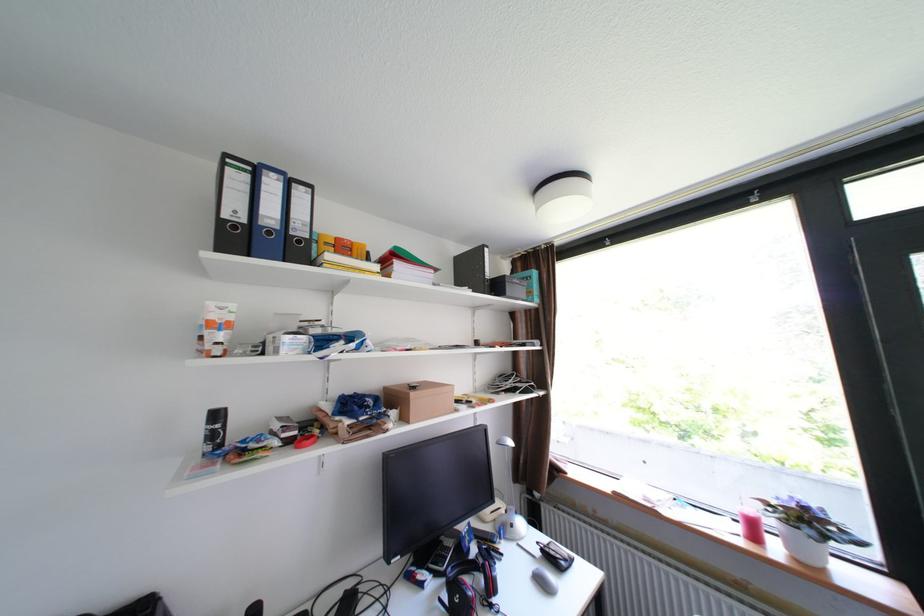
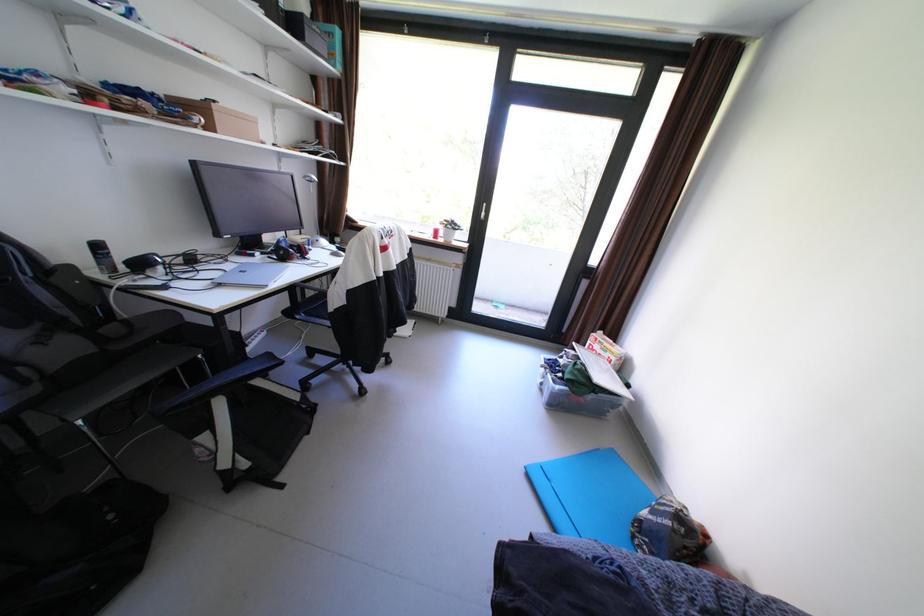
The point at [380,407] is marked in the first image. Where is the corresponding point in the second image?

(172, 100)